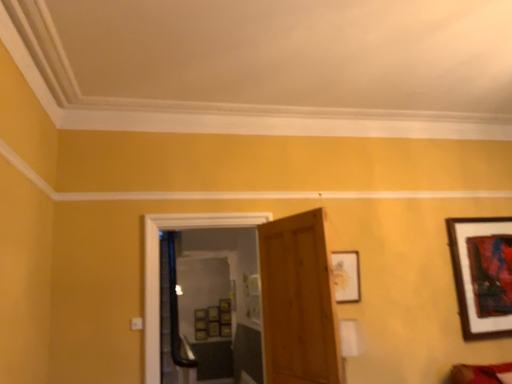
Question: Should I look upward or downward to see transparent glass door at center?

Choices:
 (A) down
 (B) up

Answer: (A)

Question: Is wooden door at center at the left side of wooden picture frame at center-right, the second picture frame positioned from the right?

Choices:
 (A) yes
 (B) no

Answer: (A)

Question: Considering the relative sizes of wooden door at center and wooden picture frame at center-right, the first picture frame when ordered from front to back, in the image provided, is wooden door at center wider than wooden picture frame at center-right, the first picture frame when ordered from front to back,?

Choices:
 (A) yes
 (B) no

Answer: (A)

Question: Is wooden door at center to the right of wooden picture frame at center-right, marked as the 2th picture frame in a back-to-front arrangement, from the viewer's perspective?

Choices:
 (A) no
 (B) yes

Answer: (A)

Question: Is wooden door at center shorter than wooden picture frame at center-right, the first picture frame when ordered from front to back?

Choices:
 (A) no
 (B) yes

Answer: (A)

Question: Can you confirm if wooden door at center is thinner than wooden picture frame at center-right, which appears as the first picture frame when viewed from the left?

Choices:
 (A) yes
 (B) no

Answer: (B)

Question: Does wooden door at center have a smaller size compared to wooden picture frame at center-right, marked as the 2th picture frame in a back-to-front arrangement?

Choices:
 (A) no
 (B) yes

Answer: (A)

Question: Is wooden door at center a part of wooden framed artwork at upper right, the second picture frame when ordered from front to back?

Choices:
 (A) no
 (B) yes

Answer: (A)

Question: Is wooden framed artwork at upper right, the 1th picture frame viewed from the right, completely or partially outside of wooden door at center?

Choices:
 (A) yes
 (B) no

Answer: (A)

Question: From a real-world perspective, is wooden framed artwork at upper right, the second picture frame when ordered from front to back, on top of wooden door at center?

Choices:
 (A) yes
 (B) no

Answer: (A)

Question: From a real-world perspective, does wooden framed artwork at upper right, the second picture frame when ordered from front to back, sit lower than wooden door at center?

Choices:
 (A) yes
 (B) no

Answer: (B)

Question: Is wooden framed artwork at upper right, positioned as the first picture frame in back-to-front order, facing towards wooden door at center?

Choices:
 (A) no
 (B) yes

Answer: (A)

Question: Is the depth of wooden picture frame at center-right, which appears as the first picture frame when viewed from the left, less than that of wooden framed artwork at upper right, the 1th picture frame viewed from the right?

Choices:
 (A) no
 (B) yes

Answer: (B)